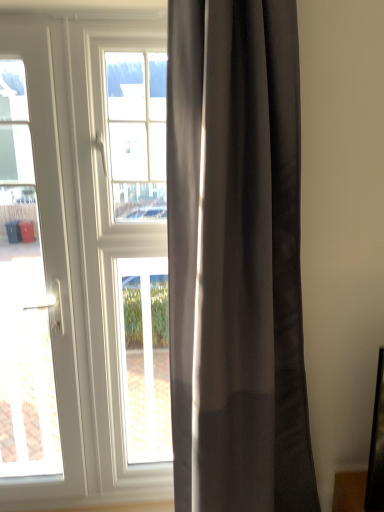
Question: Looking at the image, does white glass window at center seem bigger or smaller compared to clear glass window at center?

Choices:
 (A) small
 (B) big

Answer: (B)

Question: Relative to clear glass window at center, is white glass window at center in front or behind?

Choices:
 (A) behind
 (B) front

Answer: (B)

Question: Based on their relative distances, which object is nearer to the satin gray curtain at center?

Choices:
 (A) clear glass window at center
 (B) white glossy door at left
 (C) white glass window at center

Answer: (C)

Question: Which is nearer to the white glossy door at left?

Choices:
 (A) clear glass window at center
 (B) satin gray curtain at center
 (C) white glass window at center

Answer: (C)